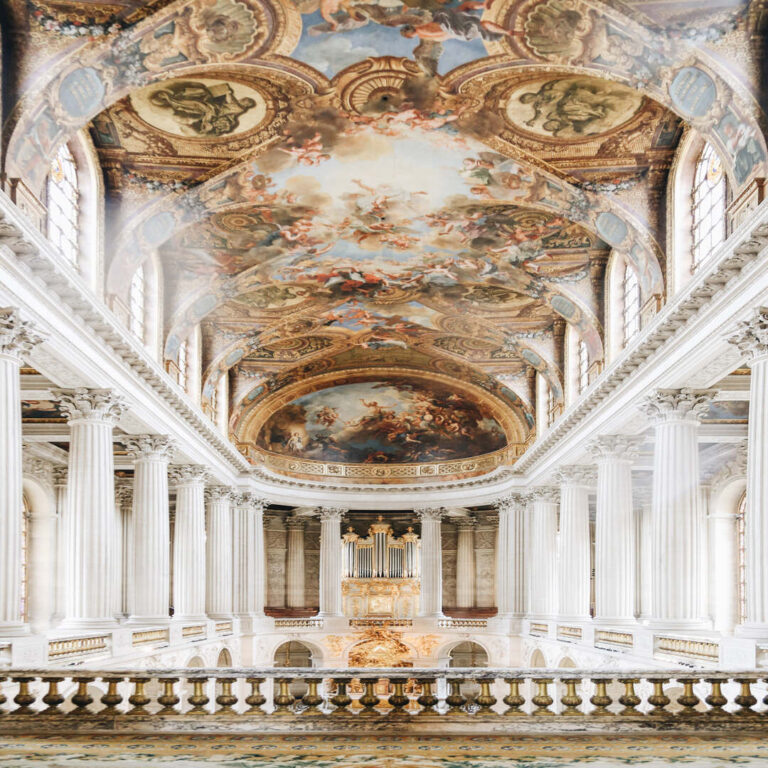
Locate an element on the screen. white pillars is located at coordinates (104, 581), (151, 568), (194, 565), (223, 567), (247, 567), (510, 574), (544, 576), (574, 578), (617, 578), (667, 578).